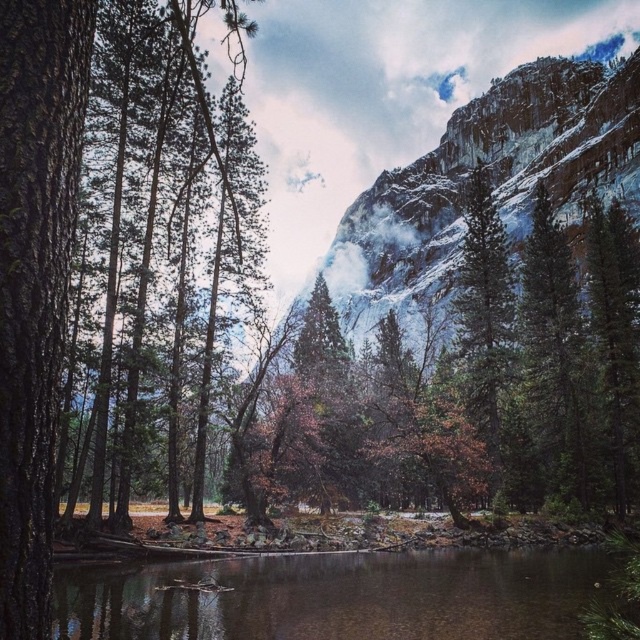
Question: Among these objects, which one is farthest from the camera?

Choices:
 (A) clear water at center
 (B) smooth bark tree at left
 (C) green matte tree at left

Answer: (A)

Question: Is smooth bark tree at left closer to the viewer compared to green matte tree at right?

Choices:
 (A) yes
 (B) no

Answer: (A)

Question: Can you confirm if smooth bark tree at left is positioned above green matte tree at right?

Choices:
 (A) no
 (B) yes

Answer: (B)

Question: From the image, what is the correct spatial relationship of smooth bark tree at left in relation to green matte tree at left?

Choices:
 (A) below
 (B) above

Answer: (A)

Question: Which point is farther to the camera?

Choices:
 (A) click(x=218, y=608)
 (B) click(x=26, y=108)
 (C) click(x=138, y=317)
 (D) click(x=579, y=321)

Answer: (D)

Question: Which object appears farthest from the camera in this image?

Choices:
 (A) green matte tree at right
 (B) green matte tree at left
 (C) smooth bark tree at left

Answer: (A)